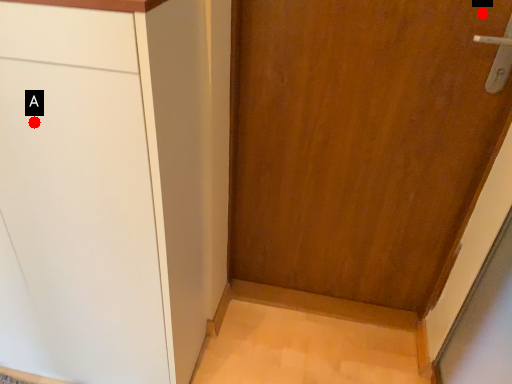
Question: Two points are circled on the image, labeled by A and B beside each circle. Which point is closer to the camera?

Choices:
 (A) A is closer
 (B) B is closer

Answer: (A)